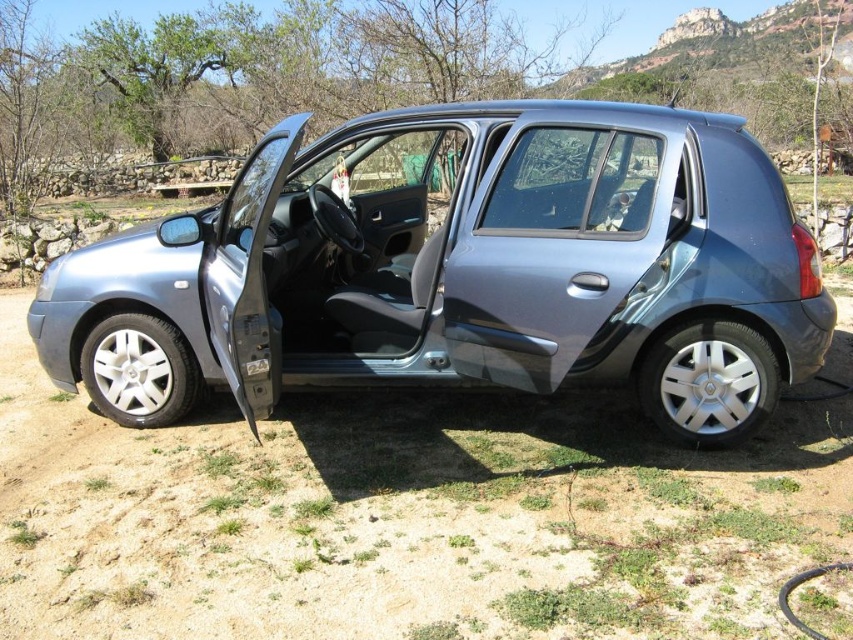
Question: Which object is farther from the camera taking this photo?

Choices:
 (A) satin metallic car door at center
 (B) satin metallic car at center

Answer: (B)

Question: Can you confirm if satin metallic car at center is positioned below satin metallic car door at center?

Choices:
 (A) no
 (B) yes

Answer: (A)

Question: Is satin metallic car at center behind satin metallic car door at center?

Choices:
 (A) no
 (B) yes

Answer: (B)

Question: Observing the image, what is the correct spatial positioning of satin metallic car at center in reference to satin metallic car door at center?

Choices:
 (A) right
 (B) left

Answer: (B)

Question: Which point is closer to the camera taking this photo?

Choices:
 (A) (195, 300)
 (B) (567, 262)

Answer: (B)